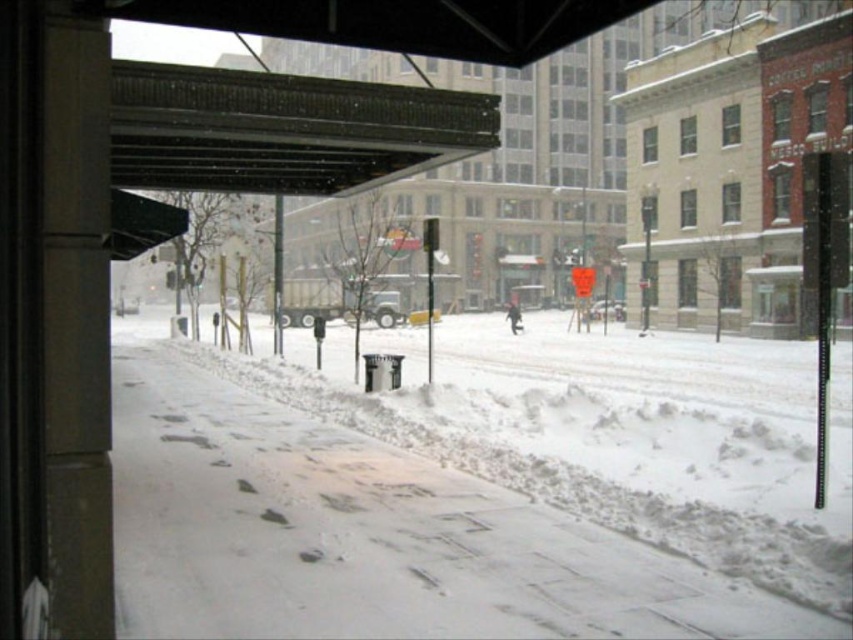
In the scene shown: Who is lower down, white snow at lower center or metallic corrugated roof at upper center?

white snow at lower center is lower down.

What do you see at coordinates (380, 528) in the screenshot? The width and height of the screenshot is (853, 640). I see `white snow at lower center` at bounding box center [380, 528].

Image resolution: width=853 pixels, height=640 pixels. What are the coordinates of `white snow at lower center` in the screenshot? It's located at (380, 528).